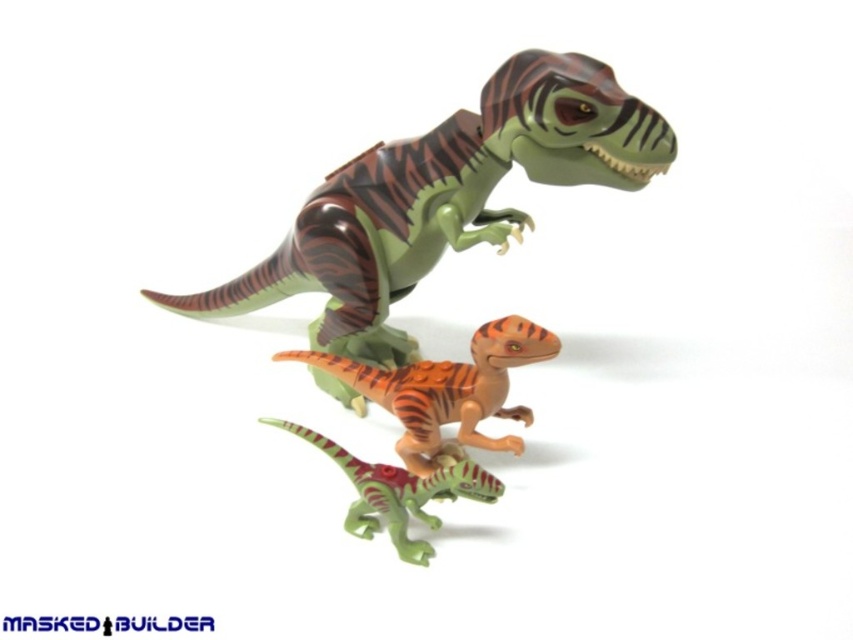
Question: Is green matte tyrannosaurus rex at center to the right of green matte dinosaur at center from the viewer's perspective?

Choices:
 (A) no
 (B) yes

Answer: (A)

Question: Which of the following is the closest to the observer?

Choices:
 (A) green matte dinosaur at center
 (B) orange-brown striped dinosaur at center
 (C) green matte tyrannosaurus rex at center

Answer: (A)

Question: Which of the following is the farthest from the observer?

Choices:
 (A) (436, 369)
 (B) (628, 116)

Answer: (A)

Question: Can you confirm if green matte tyrannosaurus rex at center is positioned above green matte dinosaur at center?

Choices:
 (A) yes
 (B) no

Answer: (A)

Question: Does green matte tyrannosaurus rex at center come behind green matte dinosaur at center?

Choices:
 (A) yes
 (B) no

Answer: (A)

Question: Which of these objects is positioned farthest from the green matte dinosaur at center?

Choices:
 (A) orange-brown striped dinosaur at center
 (B) green matte tyrannosaurus rex at center

Answer: (B)